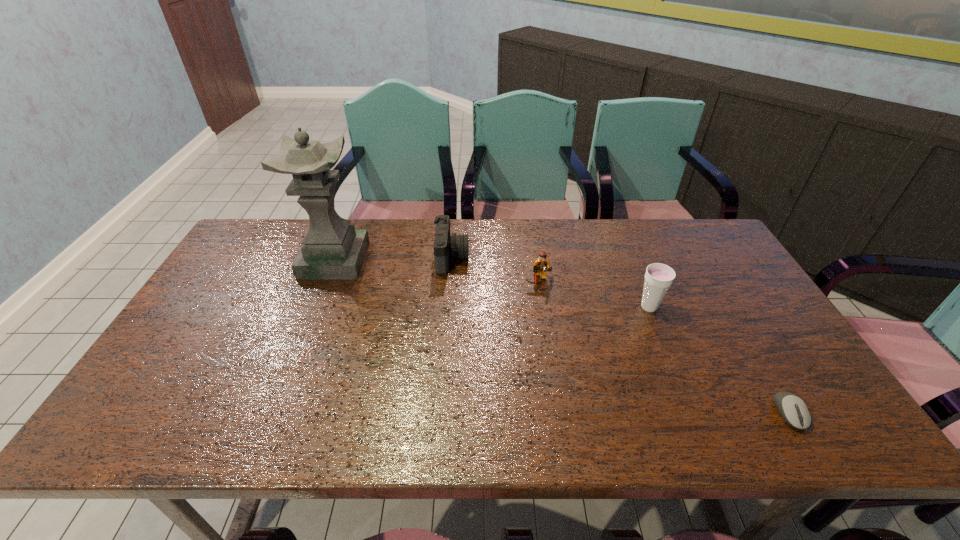
Locate an element on the screen. the tallest object is located at coordinates coord(332,249).

At what (x,y) coordinates should I click in order to perform the action: click on sculpture. Please return your answer as a coordinate pair (x, y). This screenshot has width=960, height=540. Looking at the image, I should click on (332, 249).

This screenshot has height=540, width=960. In order to click on cup in this screenshot , I will do `click(659, 277)`.

Where is `the second object from right to left`? Image resolution: width=960 pixels, height=540 pixels. the second object from right to left is located at coordinates (659, 277).

Image resolution: width=960 pixels, height=540 pixels. In order to click on the fourth object from right to left in this screenshot , I will do `click(445, 246)`.

Locate an element on the screen. The height and width of the screenshot is (540, 960). the fourth tallest object is located at coordinates (541, 264).

I want to click on the third object from right to left, so click(541, 264).

Locate an element on the screen. The image size is (960, 540). the rightmost object is located at coordinates (794, 411).

At what (x,y) coordinates should I click in order to perform the action: click on the nearest object. Please return your answer as a coordinate pair (x, y). Image resolution: width=960 pixels, height=540 pixels. Looking at the image, I should click on (794, 411).

Where is `vacant space located at the front opening of the leftmost object`? Image resolution: width=960 pixels, height=540 pixels. vacant space located at the front opening of the leftmost object is located at coordinates (424, 260).